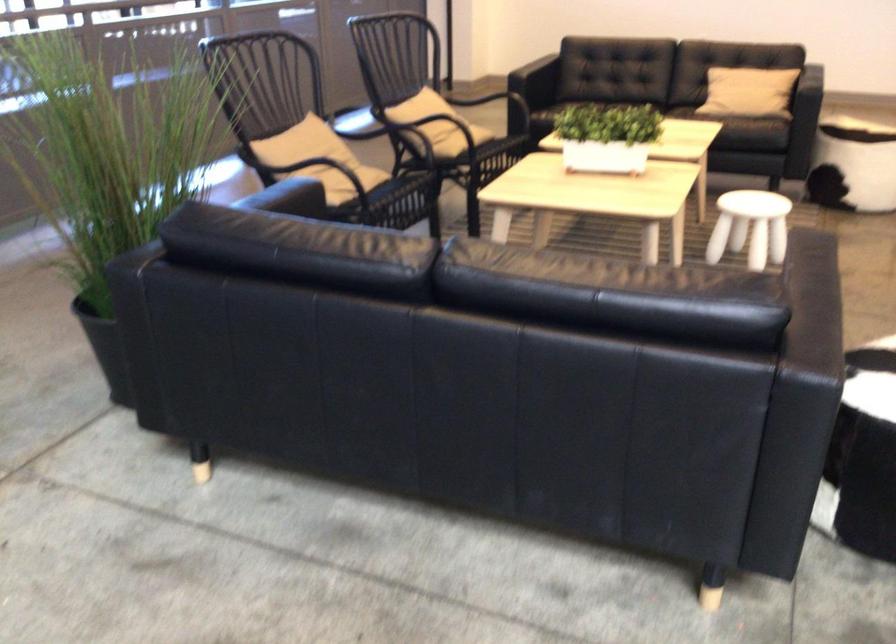
Which object does [854,161] point to?

It corresponds to the patterned cylindrical ottoman in the image.